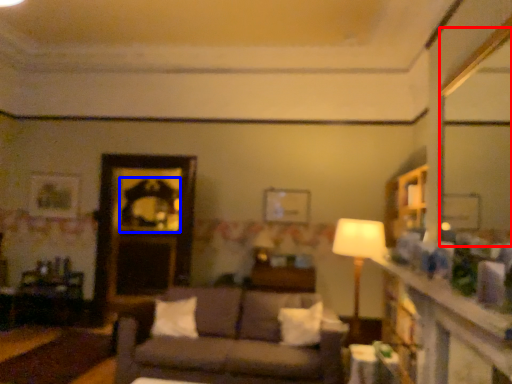
Question: Which point is further to the camera, mirror (highlighted by a red box) or mirror (highlighted by a blue box)?

Choices:
 (A) mirror
 (B) mirror

Answer: (B)